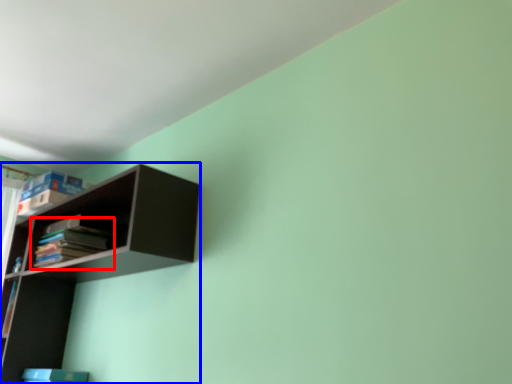
Question: Which object is closer to the camera taking this photo, book (highlighted by a red box) or shelf (highlighted by a blue box)?

Choices:
 (A) book
 (B) shelf

Answer: (B)